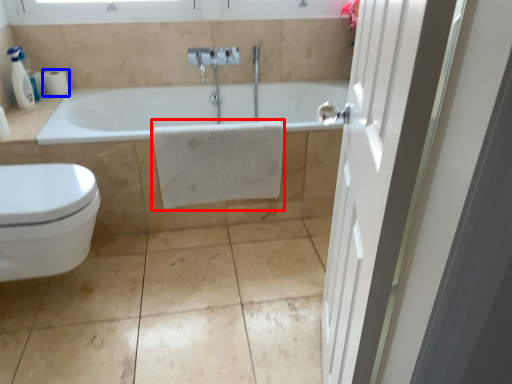
Question: Which point is further to the camera, bath towel (highlighted by a red box) or toilet paper (highlighted by a blue box)?

Choices:
 (A) bath towel
 (B) toilet paper

Answer: (B)